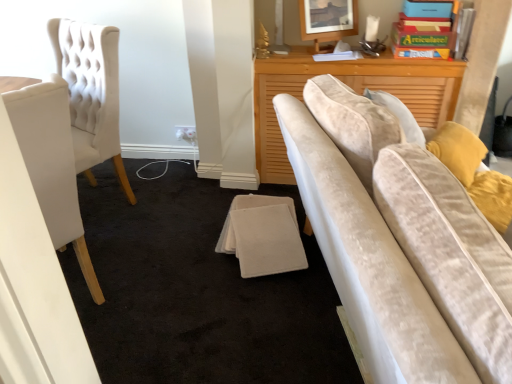
Question: From a real-world perspective, relative to white fabric chair at left, is wooden picture frame at upper center vertically above or below?

Choices:
 (A) below
 (B) above

Answer: (B)

Question: From the image's perspective, is wooden picture frame at upper center located above or below white fabric chair at left?

Choices:
 (A) above
 (B) below

Answer: (A)

Question: Do you think wooden picture frame at upper center is within white fabric chair at left, or outside of it?

Choices:
 (A) outside
 (B) inside

Answer: (A)

Question: Considering their positions, is white fabric chair at left located in front of or behind wooden picture frame at upper center?

Choices:
 (A) front
 (B) behind

Answer: (A)

Question: Considering the positions of white fabric chair at left and wooden picture frame at upper center in the image, is white fabric chair at left taller or shorter than wooden picture frame at upper center?

Choices:
 (A) tall
 (B) short

Answer: (A)

Question: In terms of width, does white fabric chair at left look wider or thinner when compared to wooden picture frame at upper center?

Choices:
 (A) thin
 (B) wide

Answer: (B)

Question: Does point (53, 153) appear closer or farther from the camera than point (305, 16)?

Choices:
 (A) farther
 (B) closer

Answer: (B)